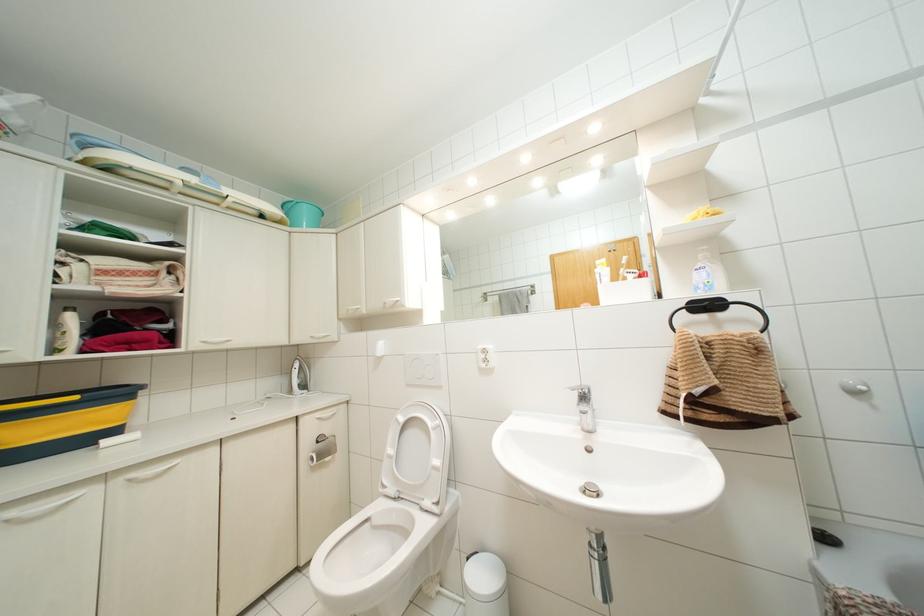
This screenshot has height=616, width=924. What do you see at coordinates (580, 390) in the screenshot?
I see `a sink faucet handle` at bounding box center [580, 390].